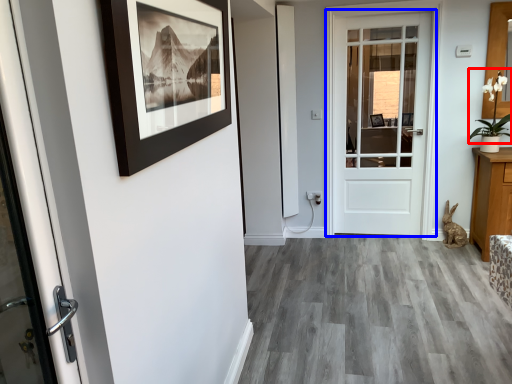
Question: Which of the following is the closest to the observer, plant (highlighted by a red box) or door (highlighted by a blue box)?

Choices:
 (A) plant
 (B) door

Answer: (A)